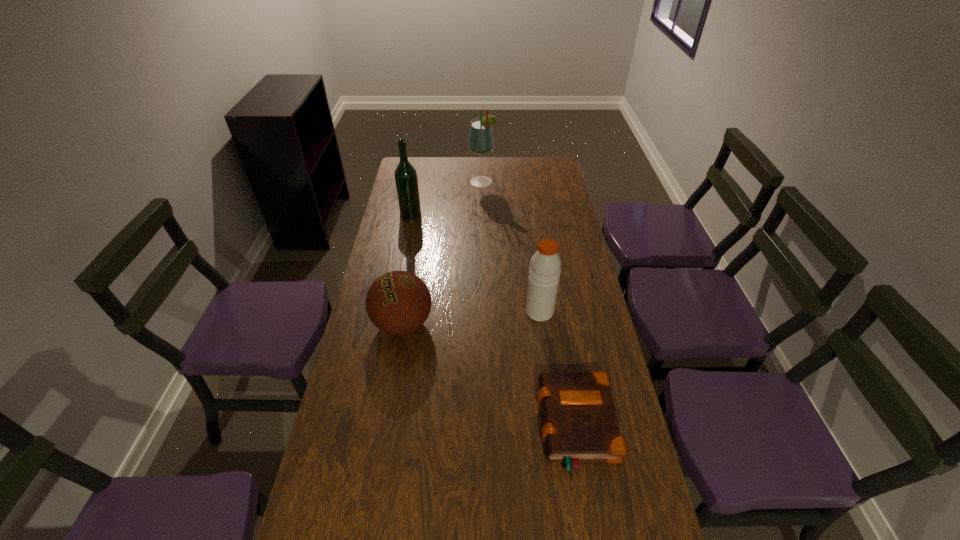
I want to click on free spot at the far edge of the desktop, so click(509, 177).

Where is `vacant area at the left edge of the desktop`? The height and width of the screenshot is (540, 960). vacant area at the left edge of the desktop is located at coordinates (350, 474).

The image size is (960, 540). I want to click on free space at the right edge of the desktop, so click(588, 502).

The image size is (960, 540). In the image, there is a desktop. In order to click on vacant space at the far right corner in this screenshot , I will do `click(540, 159)`.

Identify the location of vacant space that is in between the Bible and the fourth tallest object. (490, 375).

Where is `free point between the nearest object and the basketball`? The height and width of the screenshot is (540, 960). free point between the nearest object and the basketball is located at coordinates (490, 375).

Image resolution: width=960 pixels, height=540 pixels. I want to click on free space between the Bible and the third shortest object, so click(558, 369).

Locate an element on the screen. free space that is in between the second shortest object and the fourth nearest object is located at coordinates (x=407, y=268).

At what (x,y) coordinates should I click in order to perform the action: click on empty location between the basketball and the third object from right to left. Please return your answer as a coordinate pair (x, y). This screenshot has height=540, width=960. Looking at the image, I should click on (443, 253).

Find the location of a particular element. This screenshot has height=540, width=960. empty space between the second farthest object and the third object from left to right is located at coordinates point(446,198).